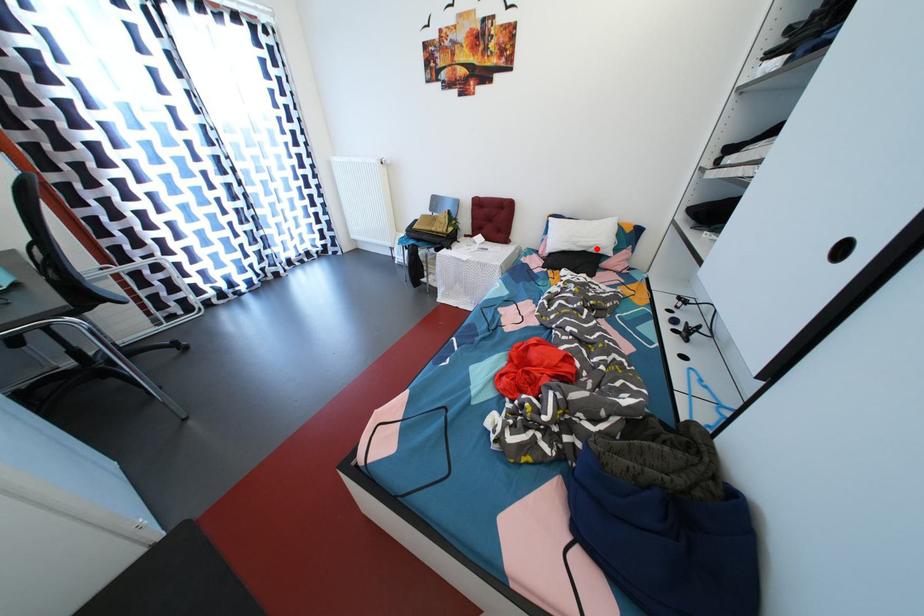
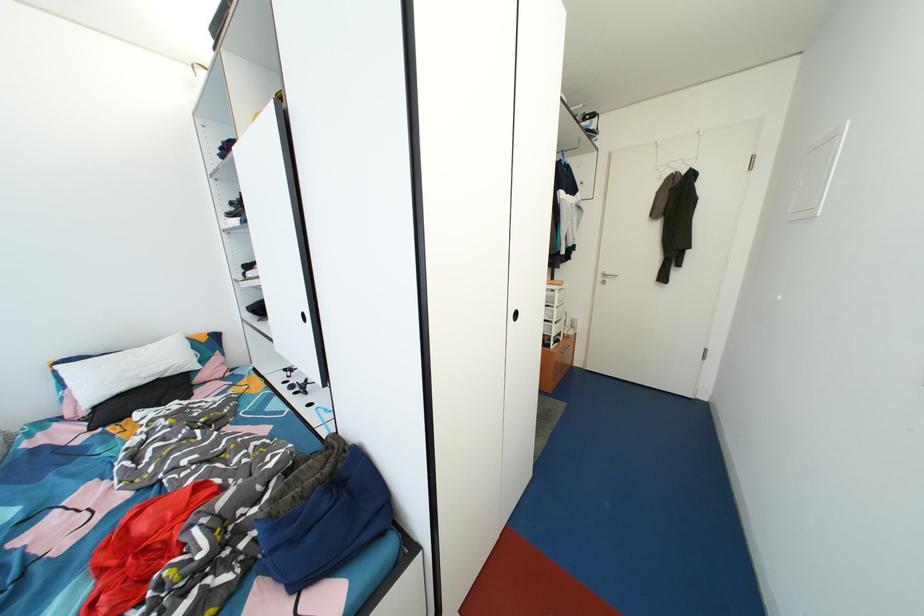
The point at the highlighted location is marked in the first image. Where is the corresponding point in the second image?

(167, 373)